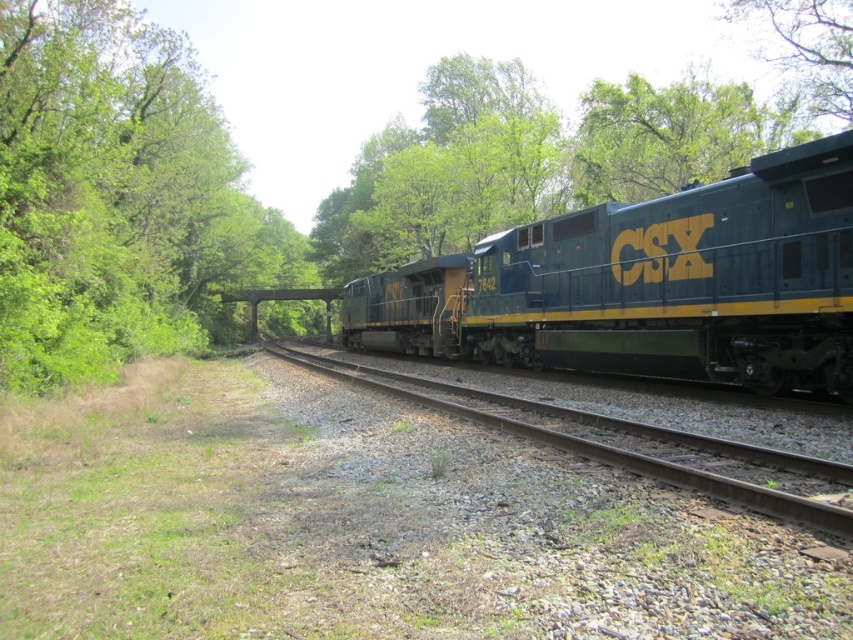
Does green metallic track at center appear over green leafy tree at upper right?

Actually, green metallic track at center is below green leafy tree at upper right.

Measure the distance from green metallic track at center to green leafy tree at upper right.

green metallic track at center and green leafy tree at upper right are 35.81 meters apart.

At what (x,y) coordinates should I click in order to perform the action: click on green metallic track at center. Please return your answer as a coordinate pair (x, y). Image resolution: width=853 pixels, height=640 pixels. Looking at the image, I should click on (631, 445).

Is green matte train at center further to camera compared to green leafy tree at upper right?

No, it is not.

Between green matte train at center and green leafy tree at upper right, which one appears on the left side from the viewer's perspective?

green matte train at center

Measure the distance between point (372, 304) and camera.

A distance of 125.68 feet exists between point (372, 304) and camera.

Locate an element on the screen. This screenshot has width=853, height=640. green matte train at center is located at coordinates (650, 284).

Who is positioned more to the left, green matte train at center or green metallic track at center?

green metallic track at center

Can you confirm if green matte train at center is thinner than green metallic track at center?

No, green matte train at center is not thinner than green metallic track at center.

Does point (508, 257) come in front of point (604, 435)?

No.

At what (x,y) coordinates should I click in order to perform the action: click on green matte train at center. Please return your answer as a coordinate pair (x, y). Looking at the image, I should click on (650, 284).